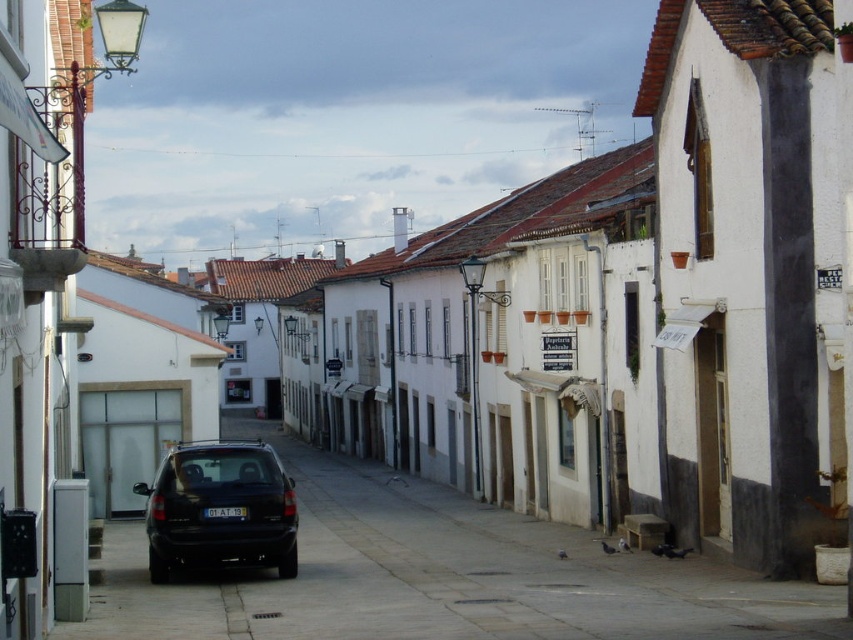
Does black matte car at center appear on the left side of matte black car at center?

Incorrect, black matte car at center is not on the left side of matte black car at center.

Does black matte car at center lie behind matte black car at center?

No, black matte car at center is in front of matte black car at center.

Which is in front, point (590, 625) or point (251, 540)?

Point (590, 625) is more forward.

Identify the location of black matte car at center. (440, 576).